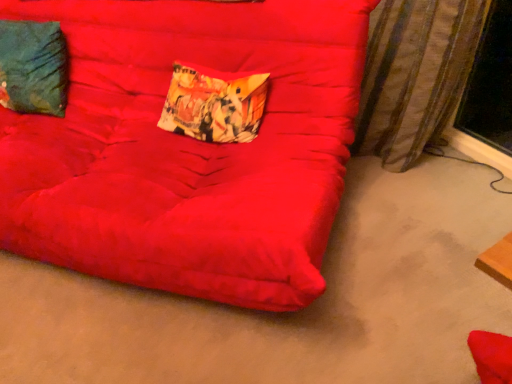
Question: In terms of height, does striped fabric curtain at right look taller or shorter compared to teal fabric pillow at upper left, the 2th pillow positioned from the right?

Choices:
 (A) short
 (B) tall

Answer: (B)

Question: Looking at the image, does striped fabric curtain at right seem bigger or smaller compared to teal fabric pillow at upper left, the 2th pillow positioned from the right?

Choices:
 (A) small
 (B) big

Answer: (B)

Question: Estimate the real-world distances between objects in this image. Which object is farther from the printed fabric pillow at center, arranged as the second pillow when viewed from the left?

Choices:
 (A) suede-like red futon at center
 (B) teal fabric pillow at upper left, arranged as the 1th pillow when viewed from the left
 (C) striped fabric curtain at right

Answer: (C)

Question: Which of these objects is positioned farthest from the teal fabric pillow at upper left, the 2th pillow positioned from the right?

Choices:
 (A) striped fabric curtain at right
 (B) printed fabric pillow at center, arranged as the second pillow when viewed from the left
 (C) suede-like red futon at center

Answer: (A)